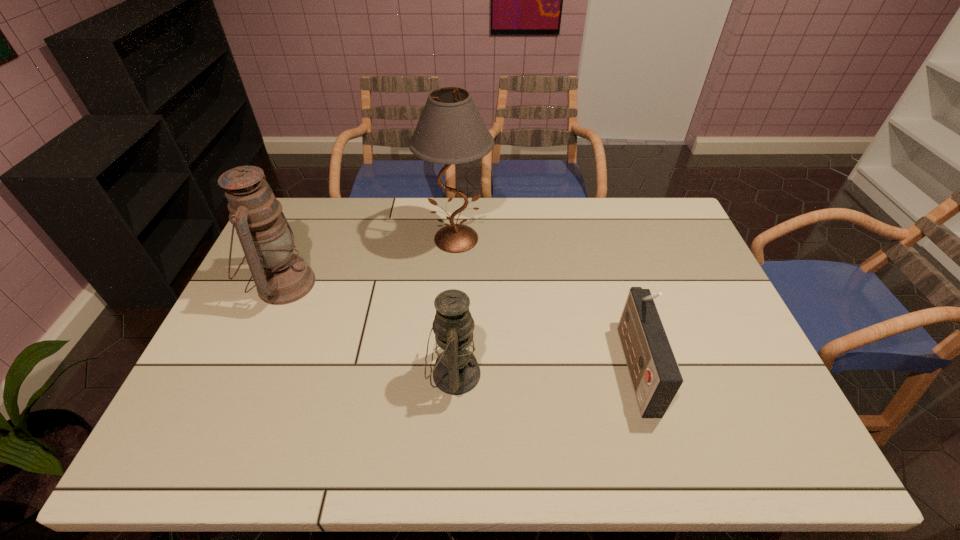
Locate an element on the screen. The image size is (960, 540). free space that satisfies the following two spatial constraints: 1. on the front-facing side of the right oil lamp; 2. on the left side of the table lamp is located at coordinates (448, 374).

Where is `free space that satisfies the following two spatial constraints: 1. on the front-facing side of the table lamp; 2. on the left side of the nearer oil lamp`? free space that satisfies the following two spatial constraints: 1. on the front-facing side of the table lamp; 2. on the left side of the nearer oil lamp is located at coordinates (448, 374).

Image resolution: width=960 pixels, height=540 pixels. Find the location of `free location that satisfies the following two spatial constraints: 1. on the front-facing side of the tallest object; 2. on the right side of the right oil lamp`. free location that satisfies the following two spatial constraints: 1. on the front-facing side of the tallest object; 2. on the right side of the right oil lamp is located at coordinates (448, 374).

Locate an element on the screen. This screenshot has height=540, width=960. vacant space that satisfies the following two spatial constraints: 1. on the front-facing side of the table lamp; 2. on the left side of the right oil lamp is located at coordinates (448, 374).

At what (x,y) coordinates should I click in order to perform the action: click on vacant position in the image that satisfies the following two spatial constraints: 1. on the front-facing side of the table lamp; 2. on the left side of the right oil lamp. Please return your answer as a coordinate pair (x, y). The width and height of the screenshot is (960, 540). Looking at the image, I should click on (448, 374).